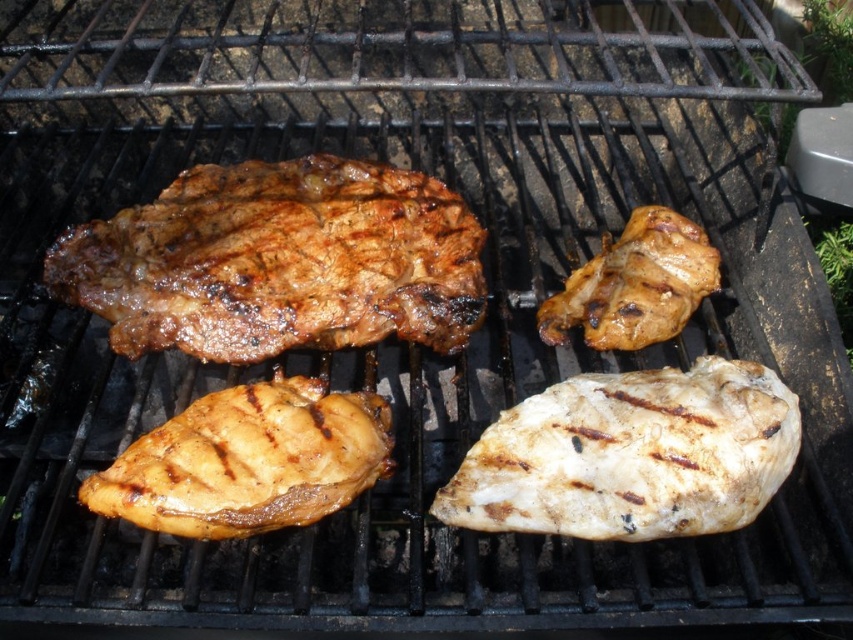
You are a chef preparing a barbecue and need to check the thickness of the meats. Which meat is thicker between the grilled brown steak at upper left and the white matte chicken breast at center?

The grilled brown steak at upper left is thicker than the white matte chicken breast at center because the description states that it has a greater height.

Consider the image. You are a chef standing 1 meter away from the barbecue grill. You need to retrieve the white matte chicken breast at center. Is the chicken breast within your reach?

The white matte chicken breast at center is 98.54 centimeters away from the viewer. Since you are standing 1 meter away, the chicken breast is within reach as it is slightly closer than your standing position.